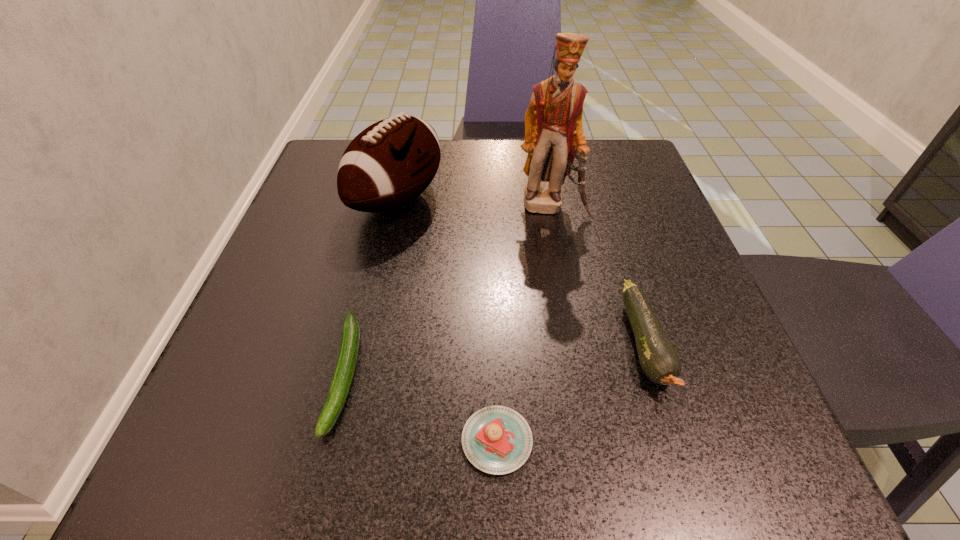
Where is `vacant space at the far edge`? vacant space at the far edge is located at coordinates (511, 151).

I want to click on vacant space at the near edge of the desktop, so click(x=529, y=465).

What are the coordinates of `vacant area at the left edge of the desktop` in the screenshot? It's located at (242, 418).

Image resolution: width=960 pixels, height=540 pixels. In order to click on free point at the right edge in this screenshot , I will do `click(679, 240)`.

The width and height of the screenshot is (960, 540). Identify the location of vacant region at the far right corner. (635, 163).

In the image, there is a desktop. Where is `vacant space at the near right corner`? The width and height of the screenshot is (960, 540). vacant space at the near right corner is located at coordinates (712, 430).

Locate an element on the screen. vacant area that lies between the third shortest object and the nutcracker is located at coordinates (598, 275).

This screenshot has width=960, height=540. Identify the location of empty space between the third shortest object and the fourth object from left to right. (598, 275).

Identify the location of free space between the football (American) and the left zucchini. This screenshot has height=540, width=960. (372, 287).

Image resolution: width=960 pixels, height=540 pixels. I want to click on unoccupied position between the fourth shortest object and the left zucchini, so click(x=372, y=287).